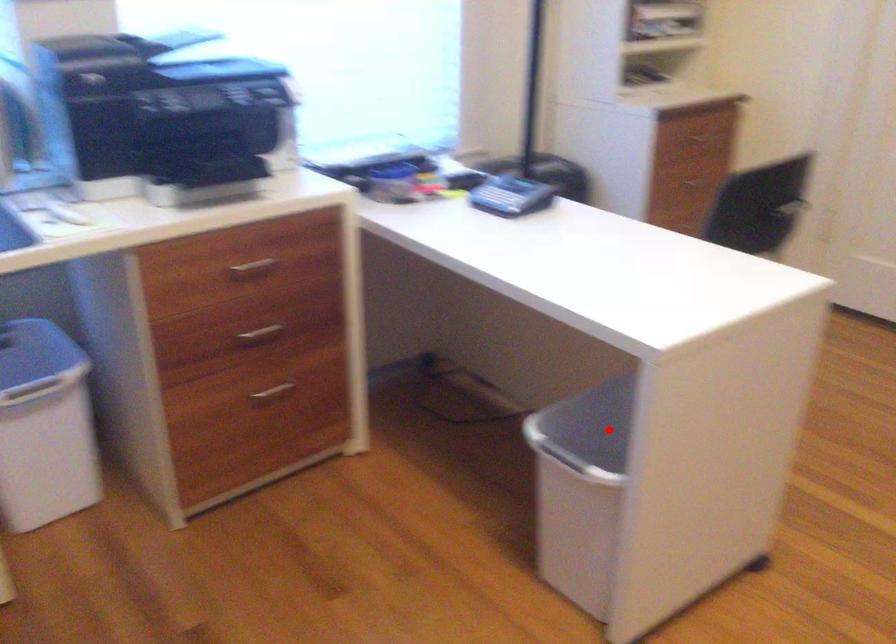
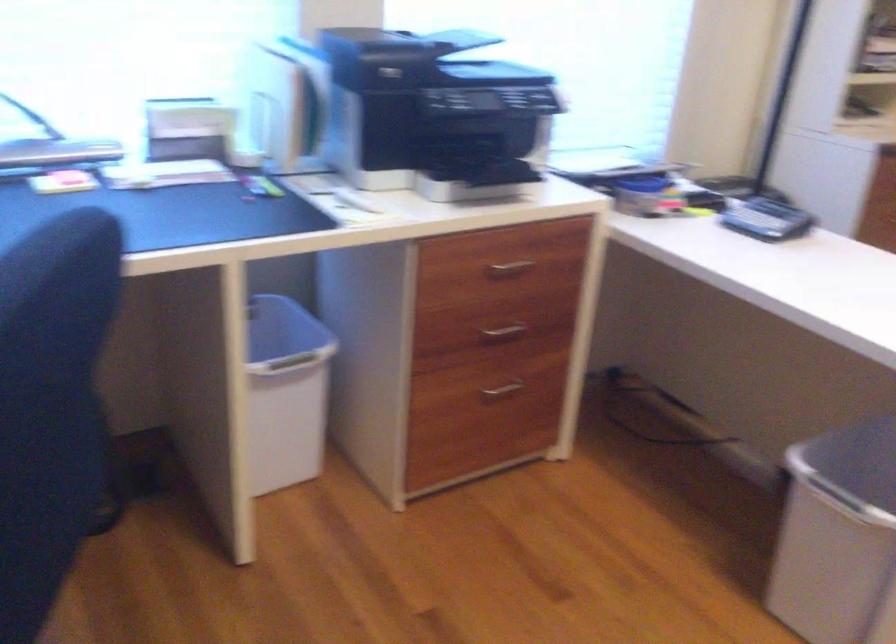
The point at the highlighted location is marked in the first image. Where is the corresponding point in the second image?

(851, 467)